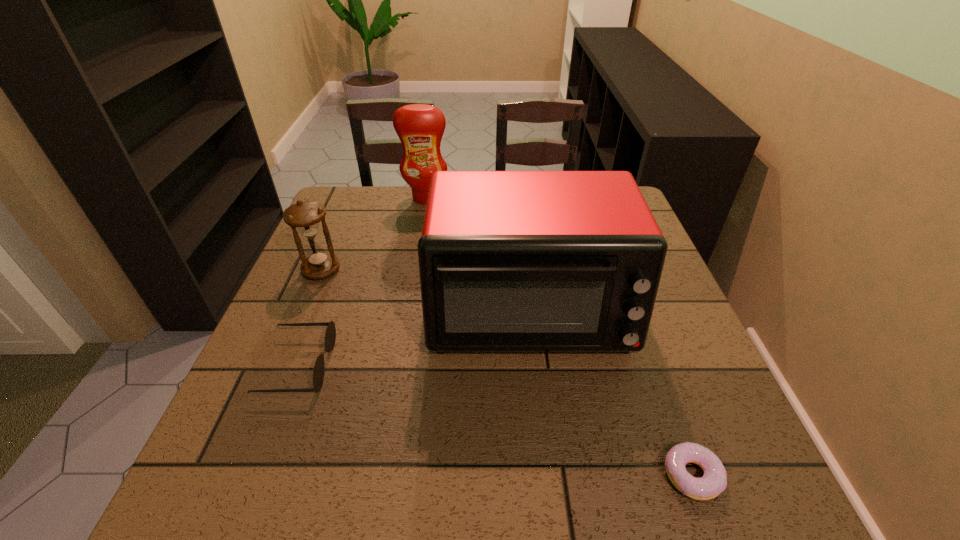
The height and width of the screenshot is (540, 960). I want to click on condiment, so click(420, 127).

Locate an element on the screen. Image resolution: width=960 pixels, height=540 pixels. toaster oven is located at coordinates (510, 261).

Where is `the third shortest object`? This screenshot has width=960, height=540. the third shortest object is located at coordinates (305, 216).

This screenshot has width=960, height=540. What are the coordinates of `sunglasses` in the screenshot? It's located at (330, 336).

Find the location of `the nearest object`. the nearest object is located at coordinates (714, 481).

The height and width of the screenshot is (540, 960). What are the coordinates of `doughnut` in the screenshot? It's located at (714, 481).

You are a GUI agent. You are given a task and a screenshot of the screen. Output one action in this format:
    pyautogui.click(x=<x>, y=<y>)
    Task: Click on the free space located on the label side of the condiment
    The image size is (960, 540).
    Given the screenshot: What is the action you would take?
    pyautogui.click(x=414, y=267)

At what (x,y) coordinates should I click in order to perform the action: click on vacant area situated 0.240m on the front-facing side of the toaster oven. Please return your answer as a coordinate pair (x, y). Looking at the image, I should click on (549, 494).

This screenshot has height=540, width=960. What are the coordinates of `vacant area situated on the back of the third shortest object` in the screenshot? It's located at (338, 230).

The image size is (960, 540). What are the coordinates of `vacant area situated on the front-facing side of the fourth tallest object` in the screenshot? It's located at (465, 366).